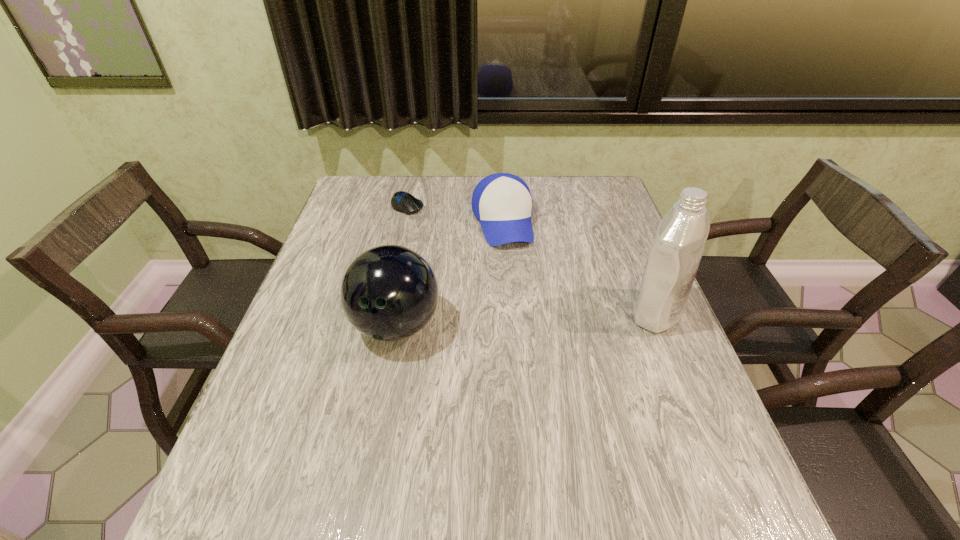
You are a GUI agent. You are given a task and a screenshot of the screen. Output one action in this format:
    pyautogui.click(x=<x>, y=<y>)
    Task: Click on the bowling ball
    This screenshot has height=540, width=960.
    Given the screenshot: What is the action you would take?
    pyautogui.click(x=388, y=293)

Where is `detergent`? Image resolution: width=960 pixels, height=540 pixels. detergent is located at coordinates (673, 261).

This screenshot has height=540, width=960. In order to click on the rightmost object in this screenshot , I will do `click(673, 261)`.

Find the location of a particular element. The image size is (960, 540). the second object from right to left is located at coordinates (502, 202).

Where is `baseball cap`? The height and width of the screenshot is (540, 960). baseball cap is located at coordinates (502, 202).

Find the location of `computer mouse`. computer mouse is located at coordinates (404, 202).

Identify the location of vacant area located on the side of the bowling ball with the finger holes. (384, 389).

Where is `free space located on the front of the detergent`? The height and width of the screenshot is (540, 960). free space located on the front of the detergent is located at coordinates (701, 420).

Locate an element on the screen. Image resolution: width=960 pixels, height=540 pixels. vacant space located 0.350m on the front-facing side of the baseball cap is located at coordinates (532, 349).

You are a GUI agent. You are given a task and a screenshot of the screen. Output one action in this format:
    pyautogui.click(x=<x>, y=<y>)
    Task: Click on the free space located on the front-facing side of the baseball cap
    
    Given the screenshot: What is the action you would take?
    pyautogui.click(x=517, y=293)